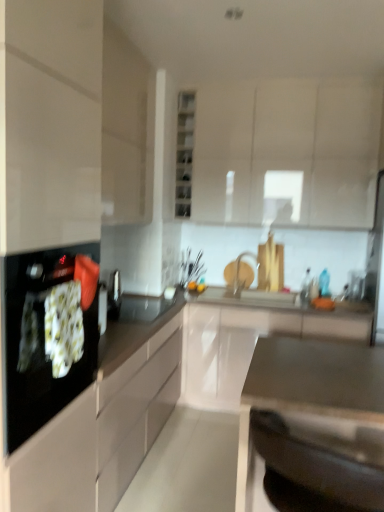
Find the location of a particular element. free space above satin metallic sink at lower center, which is the second countertop from back to front (from a real-world perspective) is located at coordinates (331, 362).